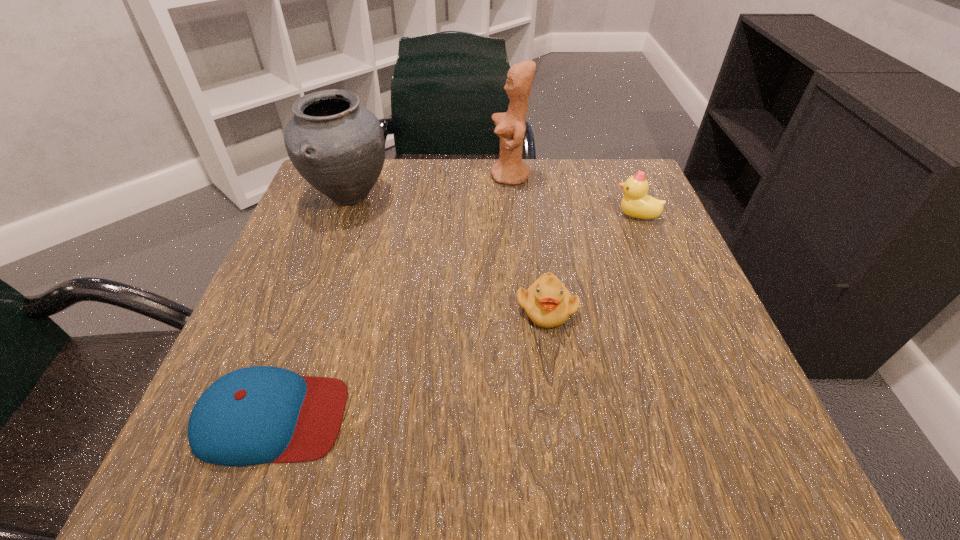
Locate an element on the screen. unoccupied position between the nearest object and the rightmost object is located at coordinates (x=454, y=316).

At what (x,y) coordinates should I click in order to perform the action: click on free space that is in between the nearest object and the fourth shortest object. Please return your answer as a coordinate pair (x, y). This screenshot has width=960, height=540. Looking at the image, I should click on (311, 307).

Identify the location of vacant point located between the second nearest object and the farther duckling. This screenshot has width=960, height=540. (591, 262).

Locate which object ranks fourth in proximity to the figurine. Please provide its 2D coordinates. Your answer should be formatted as a tuple, i.e. [(x, y)], where the tuple contains the x and y coordinates of a point satisfying the conditions above.

[(255, 415)]

I want to click on object that is the fourth nearest to the urn, so click(636, 203).

Locate an element on the screen. This screenshot has height=540, width=960. vacant point that satisfies the following two spatial constraints: 1. on the front-facing side of the right duckling; 2. on the front-facing side of the left duckling is located at coordinates (675, 308).

Where is `free location that satisfies the following two spatial constraints: 1. on the front-facing side of the figurine; 2. on the front side of the fourth shortest object`? This screenshot has height=540, width=960. free location that satisfies the following two spatial constraints: 1. on the front-facing side of the figurine; 2. on the front side of the fourth shortest object is located at coordinates (512, 196).